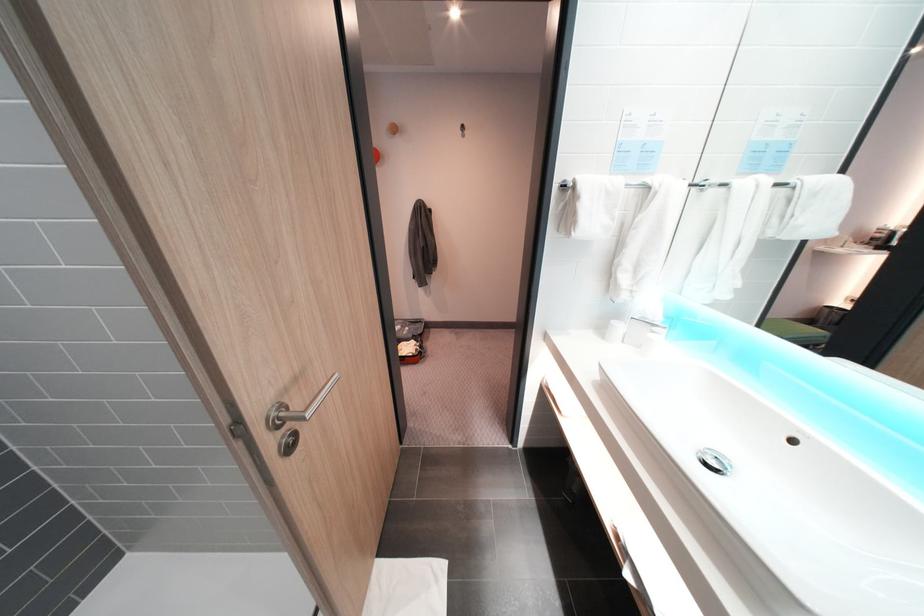
You are a GUI agent. You are given a task and a screenshot of the screen. Output one action in this format:
    pyautogui.click(x=<x>, y=<y>)
    Task: Click on the metal door handle
    
    Given the screenshot: What is the action you would take?
    pyautogui.click(x=298, y=408)